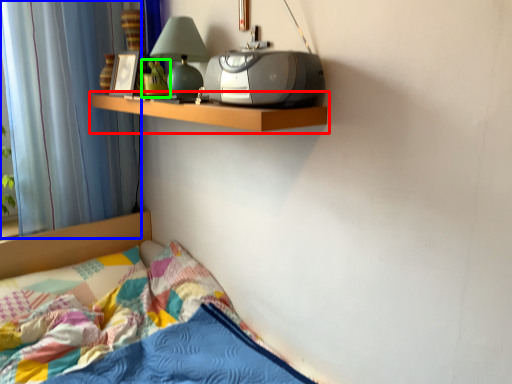
Question: Which object is the farthest from shelf (highlighted by a red box)? Choose among these: curtain (highlighted by a blue box) or toy (highlighted by a green box).

Choices:
 (A) curtain
 (B) toy

Answer: (A)